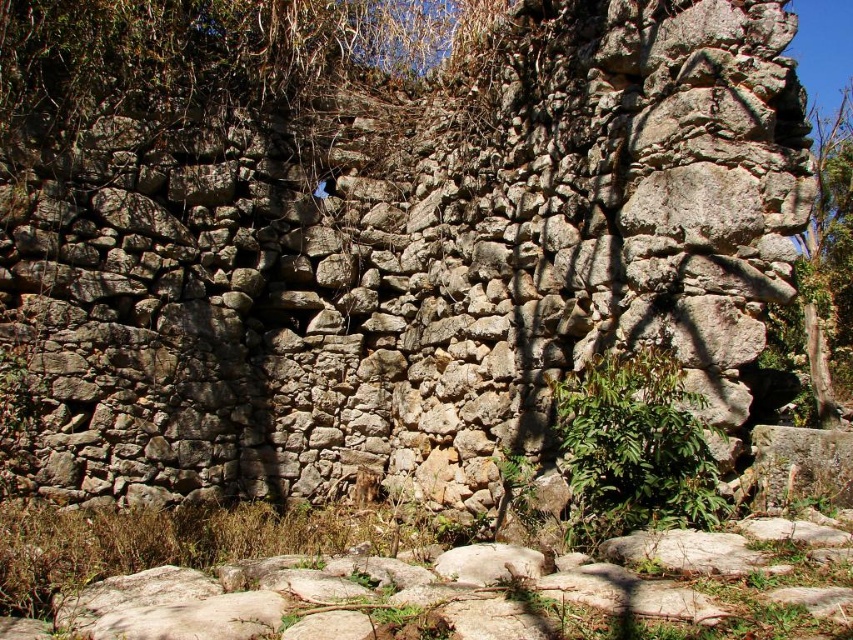
Is brown rough stone wall at upper center taller than green leafy plant at center?

Indeed, brown rough stone wall at upper center has a greater height compared to green leafy plant at center.

Is point (347, 67) closer to viewer compared to point (694, 424)?

No, it is behind (694, 424).

You are a GUI agent. You are given a task and a screenshot of the screen. Output one action in this format:
    pyautogui.click(x=<x>, y=<y>)
    Task: Click on the brown rough stone wall at upper center
    
    Given the screenshot: What is the action you would take?
    pyautogui.click(x=209, y=54)